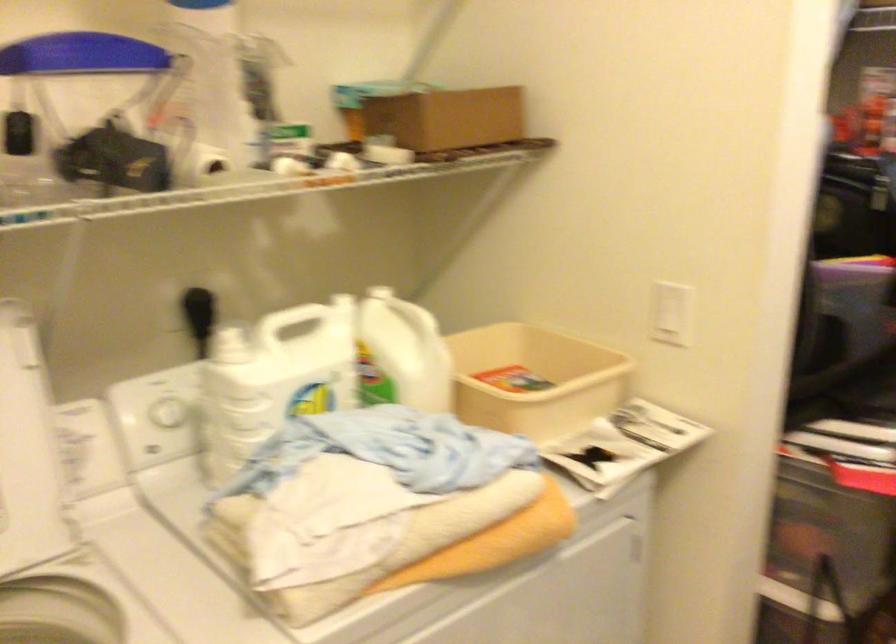
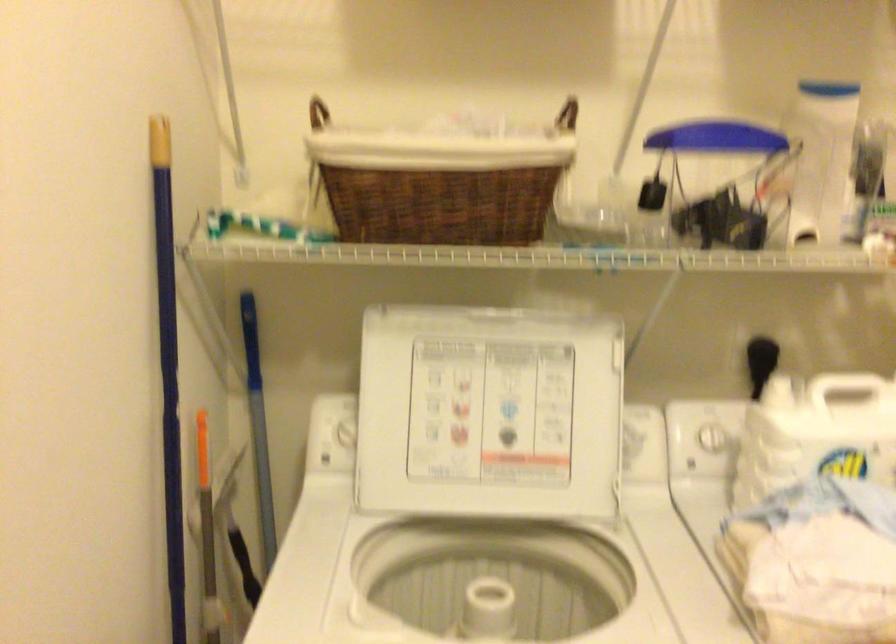
Locate, in the second image, the point that corresponds to point 194,315 in the first image.

(760, 362)